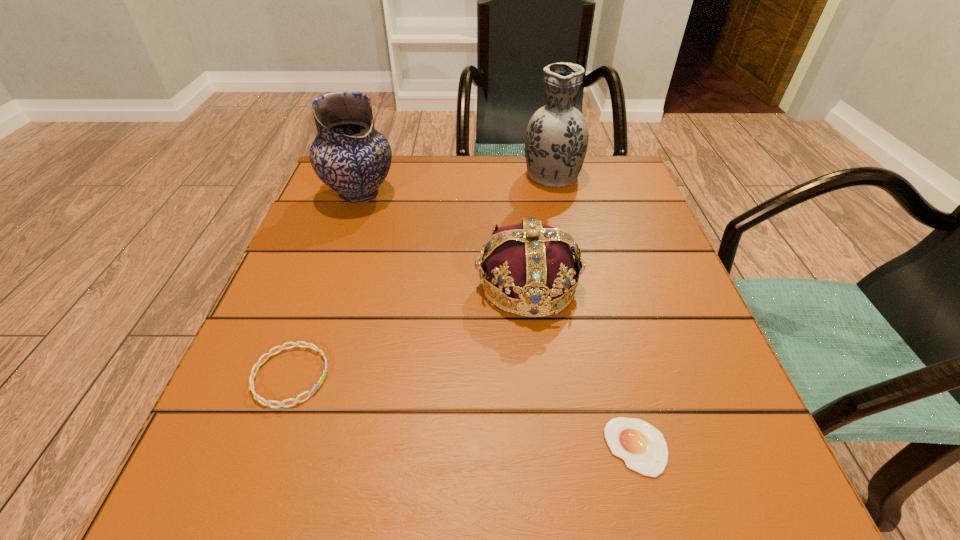
Identify the location of vacant region between the tallest object and the second tallest object. The height and width of the screenshot is (540, 960). (456, 184).

Find the location of a particular element. The height and width of the screenshot is (540, 960). free point between the egg yolk and the third nearest object is located at coordinates (582, 366).

At what (x,y) coordinates should I click in order to perform the action: click on empty space between the second tallest object and the tallest object. Please return your answer as a coordinate pair (x, y). This screenshot has width=960, height=540. Looking at the image, I should click on (456, 184).

Locate an element on the screen. The width and height of the screenshot is (960, 540). free spot between the pottery and the fourth tallest object is located at coordinates (325, 285).

Identify the location of empty space that is in between the tallest object and the bracelet. The width and height of the screenshot is (960, 540). (421, 275).

Where is `free space between the crown and the pottery`? The height and width of the screenshot is (540, 960). free space between the crown and the pottery is located at coordinates (444, 239).

Locate which object ranks third in proximity to the egg yolk. Please provide its 2D coordinates. Your answer should be formatted as a tuple, i.e. [(x, y)], where the tuple contains the x and y coordinates of a point satisfying the conditions above.

[(556, 141)]

At what (x,y) coordinates should I click in order to perform the action: click on the closest object to the pottery. Please return your answer as a coordinate pair (x, y). The image size is (960, 540). Looking at the image, I should click on (534, 263).

I want to click on blank space that satisfies the following two spatial constraints: 1. on the front side of the second tallest object; 2. on the surface of the second shortest object showing star-shaped elements, so click(x=296, y=376).

Identify the location of vacant position in the image that satisfies the following two spatial constraints: 1. on the surface of the bracelet showing star-shaped elements; 2. on the right side of the shortest object. The height and width of the screenshot is (540, 960). coord(265,447).